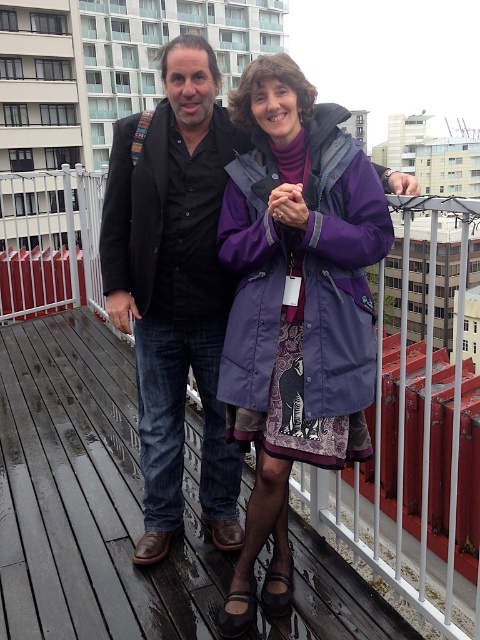
Question: Does wooden at center appear on the left side of purple matte coat at center?

Choices:
 (A) yes
 (B) no

Answer: (A)

Question: Which object is the closest to the black matte coat at center?

Choices:
 (A) purple matte coat at center
 (B) wooden at center
 (C) black matte jacket at center

Answer: (C)

Question: Does wooden at center have a greater width compared to black matte coat at center?

Choices:
 (A) yes
 (B) no

Answer: (A)

Question: Is the position of purple matte coat at center more distant than that of black matte jacket at center?

Choices:
 (A) no
 (B) yes

Answer: (A)

Question: Which of these objects is positioned farthest from the wooden at center?

Choices:
 (A) black matte coat at center
 (B) black matte jacket at center

Answer: (A)

Question: Which of these objects is positioned closest to the black matte coat at center?

Choices:
 (A) black matte jacket at center
 (B) wooden at center
 (C) purple matte coat at center

Answer: (A)